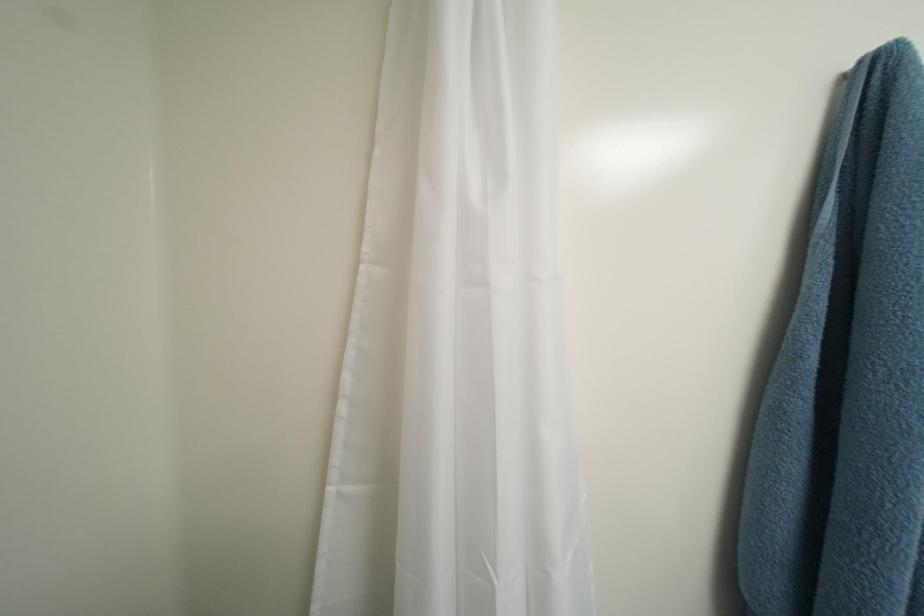
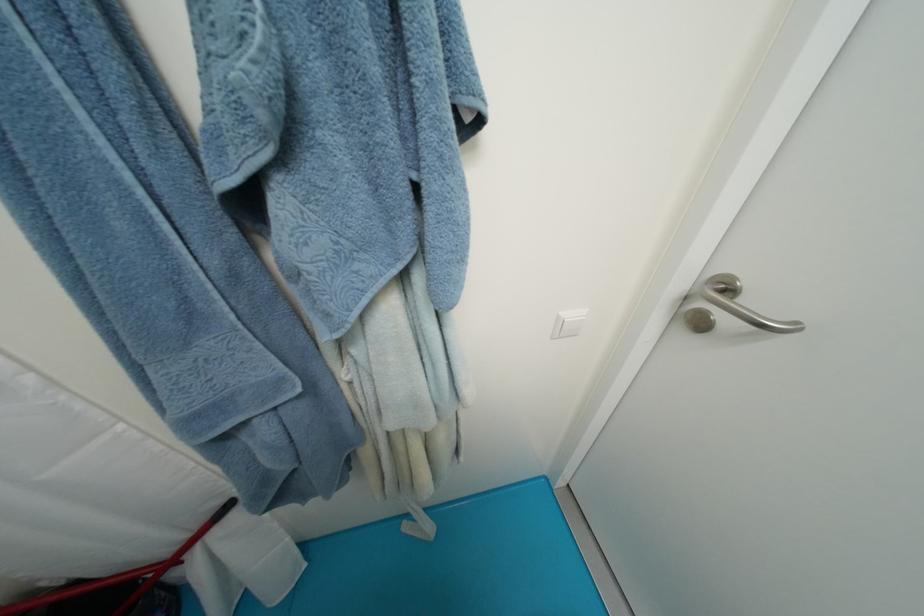
Based on the continuous images, in which direction is the camera rotating?

The rotation direction of the camera is right-down.